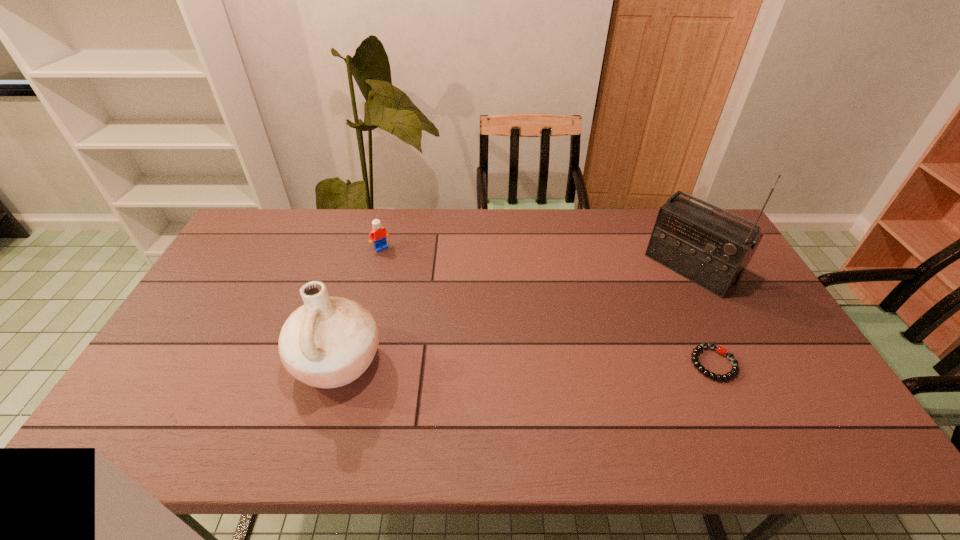
This screenshot has width=960, height=540. Find the location of `free region at the far edge of the desktop`. free region at the far edge of the desktop is located at coordinates (326, 220).

The width and height of the screenshot is (960, 540). What are the coordinates of `blank space at the near edge of the desktop` in the screenshot? It's located at (522, 393).

Identify the location of free location at the left edge. (227, 282).

The width and height of the screenshot is (960, 540). I want to click on vacant space at the right edge of the desktop, so click(771, 325).

This screenshot has height=540, width=960. I want to click on vacant space at the near left corner, so click(194, 389).

The width and height of the screenshot is (960, 540). I want to click on blank region between the pottery and the radio receiver, so click(x=514, y=315).

Locate an element on the screen. free space between the pottery and the bracelet is located at coordinates (526, 363).

In order to click on vacant area between the radio receiver and the bracelet in this screenshot , I will do `click(702, 316)`.

Image resolution: width=960 pixels, height=540 pixels. I want to click on vacant region between the shortest object and the Lego, so click(x=547, y=306).

Where is `vacant point located between the shortest object and the pottery`? The width and height of the screenshot is (960, 540). vacant point located between the shortest object and the pottery is located at coordinates (526, 363).